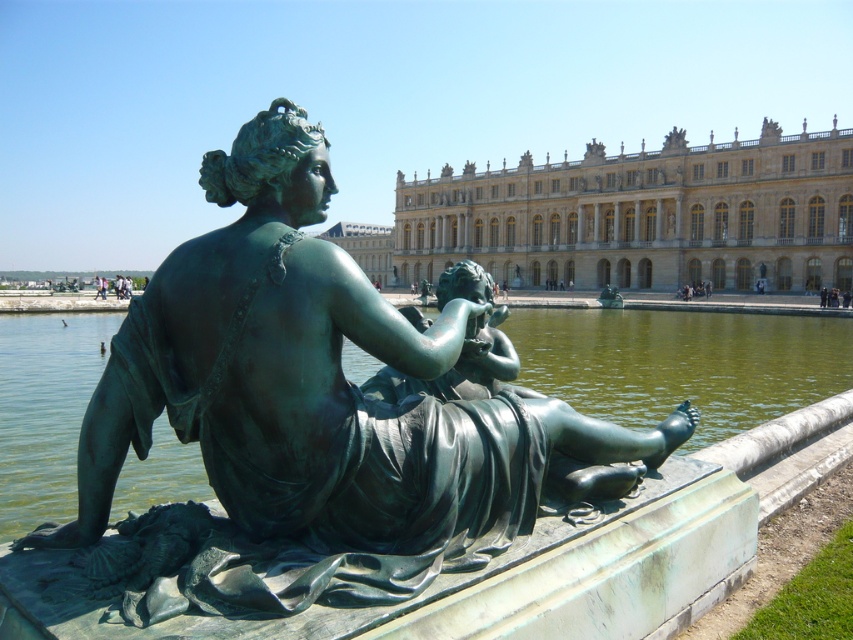
You are a visitor standing in front of the grand palace. You see the green patina statue at center and the green patina water at statue center. Which object is located to the right of the other?

The green patina statue at center is positioned on the right side of green patina water at statue center, so the statue is to the right of the water.

You are a tour guide leading a group to the golden stone palace at center. You want to ensure your group stays within a 30 meter radius of the palace for safety. Is the green patina water at statue center within this safety zone?

The golden stone palace at center and green patina water at statue center are 37.30 meters apart. Since 37.30 meters exceeds the 30 meter safety radius, the green patina water at statue center is outside the safety zone.